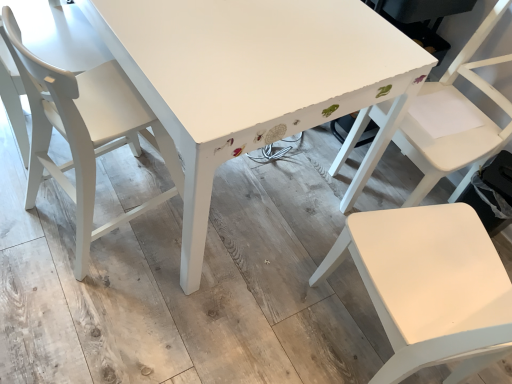
Find the location of a particular element. blank area beneath white matte chair at right, the 2th chair when ordered from right to left (from a real-world perspective) is located at coordinates (351, 320).